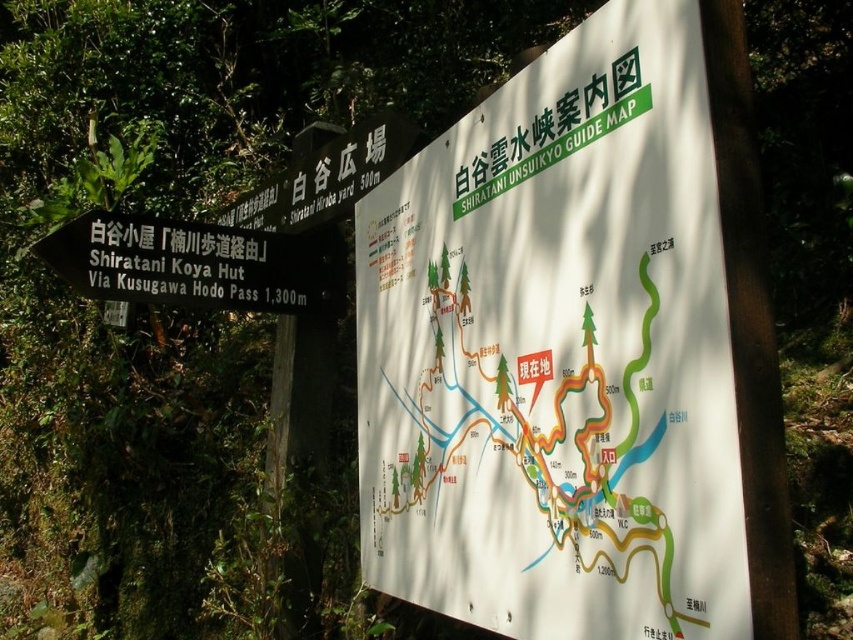
Looking at this image, can you confirm if white matte guide map at center is thinner than black plastic sign at left?

Indeed, white matte guide map at center has a lesser width compared to black plastic sign at left.

Between white matte guide map at center and black plastic sign at left, which one is positioned lower?

Positioned lower is white matte guide map at center.

This screenshot has width=853, height=640. What are the coordinates of `white matte guide map at center` in the screenshot? It's located at (556, 353).

Image resolution: width=853 pixels, height=640 pixels. In order to click on white matte guide map at center in this screenshot , I will do `click(556, 353)`.